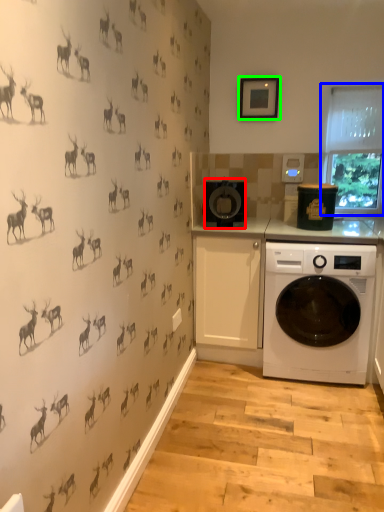
Question: Which is farther away from appliance (highlighted by a red box)? window screen (highlighted by a blue box) or picture frame (highlighted by a green box)?

Choices:
 (A) window screen
 (B) picture frame

Answer: (A)